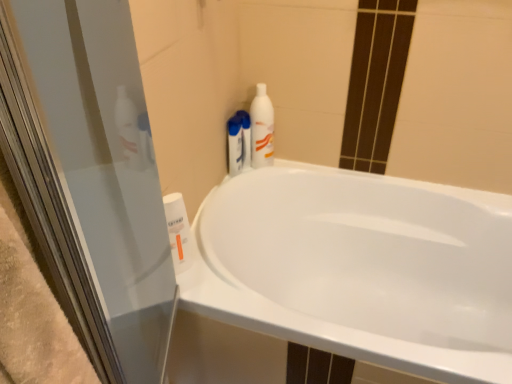
Identify the location of vacant space to the right of white glossy bottle at lower left, marked as the first cleaning product in a bottom-to-top arrangement. click(x=218, y=283).